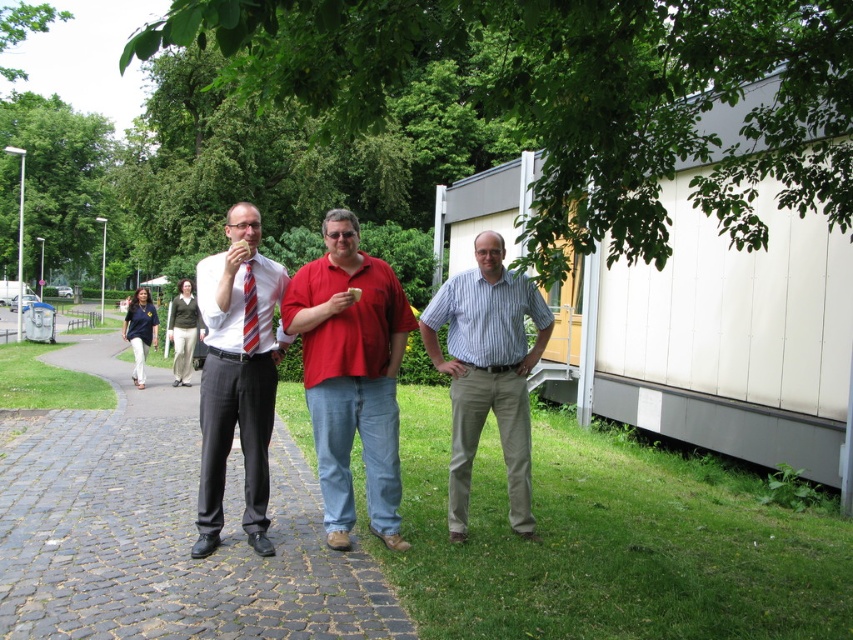
Question: From the image, what is the correct spatial relationship of matte red shirt at center in relation to dark blue shirt at center?

Choices:
 (A) right
 (B) left

Answer: (A)

Question: Is dark blue shirt at center smaller than red striped tie at center?

Choices:
 (A) no
 (B) yes

Answer: (A)

Question: Based on their relative distances, which object is nearer to the matte red shirt at center?

Choices:
 (A) cobblestone pavement at lower left
 (B) matte black suit at left

Answer: (B)

Question: Which of the following is the closest to the observer?

Choices:
 (A) striped cotton shirt at center
 (B) matte red shirt at center

Answer: (B)

Question: Is the position of matte red shirt at center less distant than that of striped cotton shirt at center?

Choices:
 (A) no
 (B) yes

Answer: (B)

Question: Which point appears farthest from the camera in this image?

Choices:
 (A) (477, 403)
 (B) (236, 301)
 (C) (386, 541)

Answer: (A)